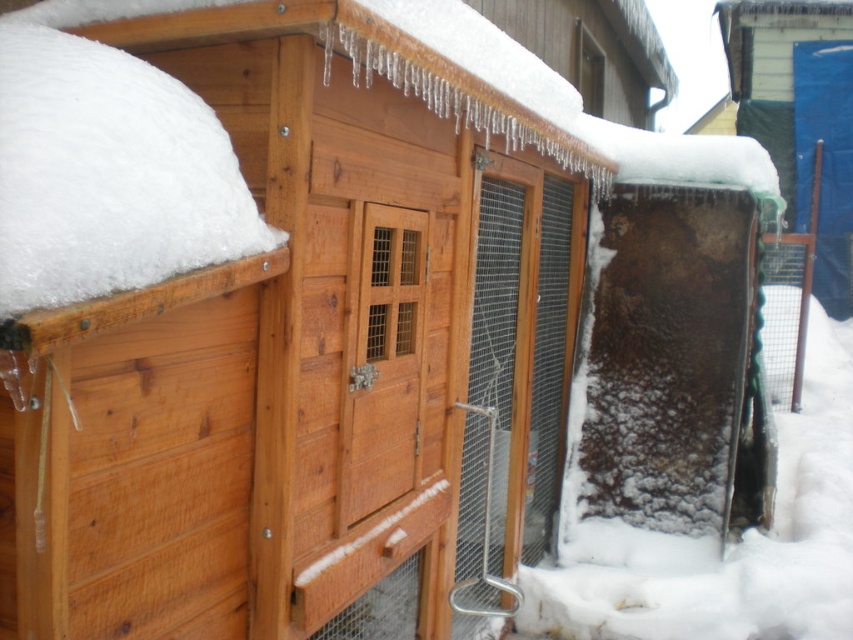
You are standing in front of the wooden structure and want to check the insulation on the right side. Which object would you need to move closer to first, the white fluffy snow at upper left or the frosted glass door at right?

You need to move closer to the white fluffy snow at upper left first since it is closer to you than the frosted glass door at right.

You are a farmer checking the chicken coop in winter. You notice the white fluffy snow at upper left and the frosted glass door at right. Which object is higher in height?

The white fluffy snow at upper left is taller than the frosted glass door at right.